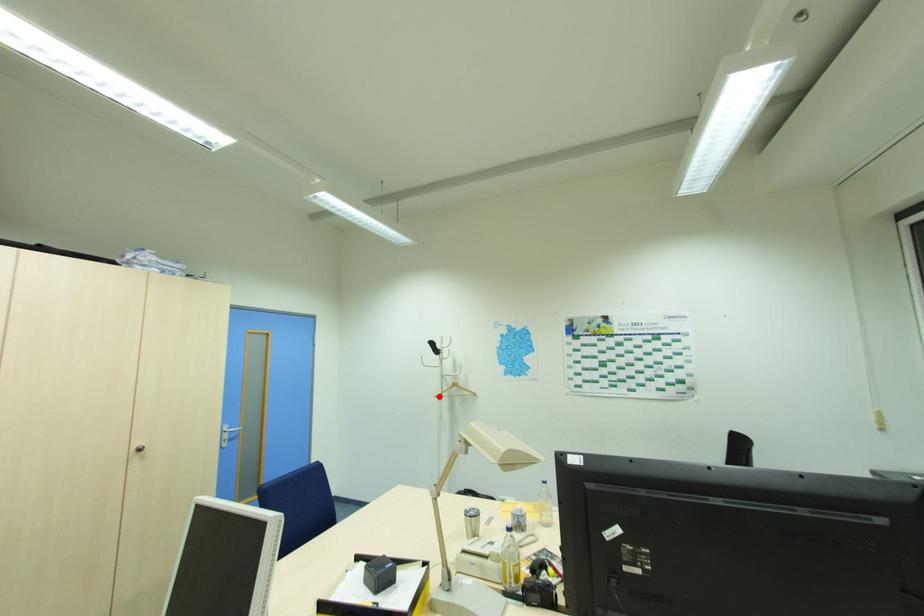
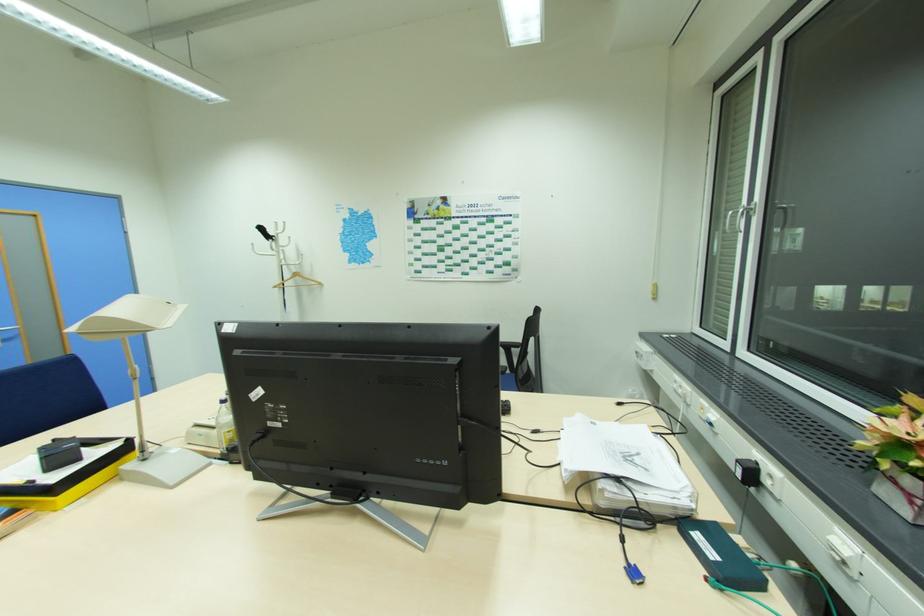
In the second image, find the point that corresponds to the highlighted location in the first image.

(277, 286)